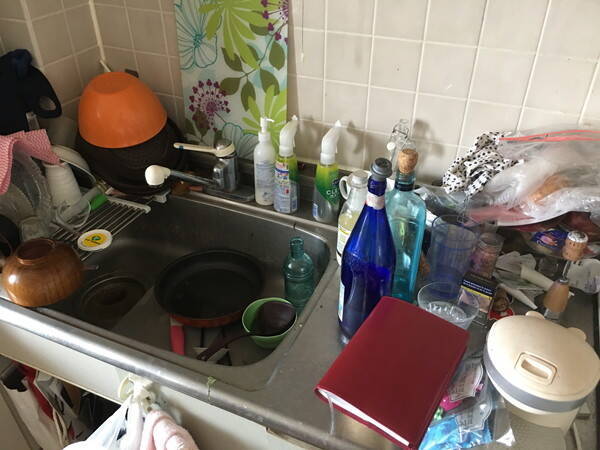
Identify the location of countertop. (306, 365).